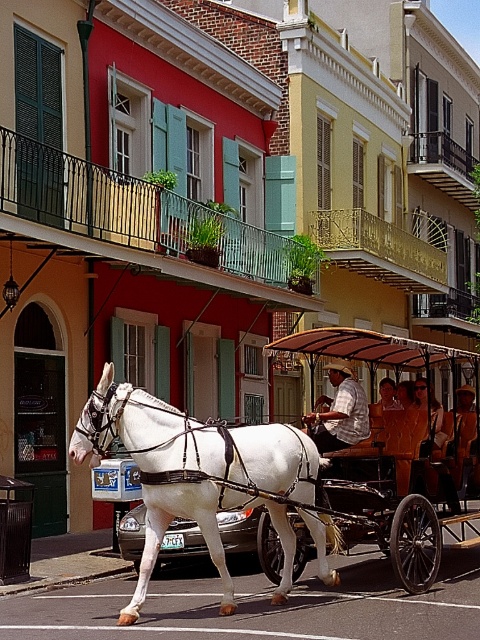
You are a tourist standing on the sidewalk and want to take a photo of the white glossy horse at center and the wooden coach at center. Which one should you focus on first to ensure both are in the frame?

You should focus on the white glossy horse at center first because it is closer to you than the wooden coach at center, ensuring both are in the frame.

You are standing at the point labeled as point (196, 474) in the image. What object are you currently standing on?

The point (196, 474) is on the white glossy horse at center, so you are standing on the white glossy horse at center.